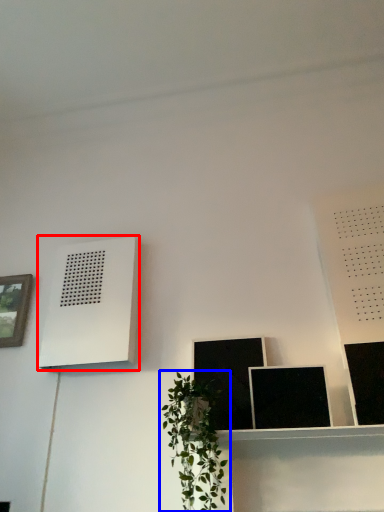
Question: Which object appears farthest to the camera in this image, air conditioner (highlighted by a red box) or houseplant (highlighted by a blue box)?

Choices:
 (A) air conditioner
 (B) houseplant

Answer: (A)